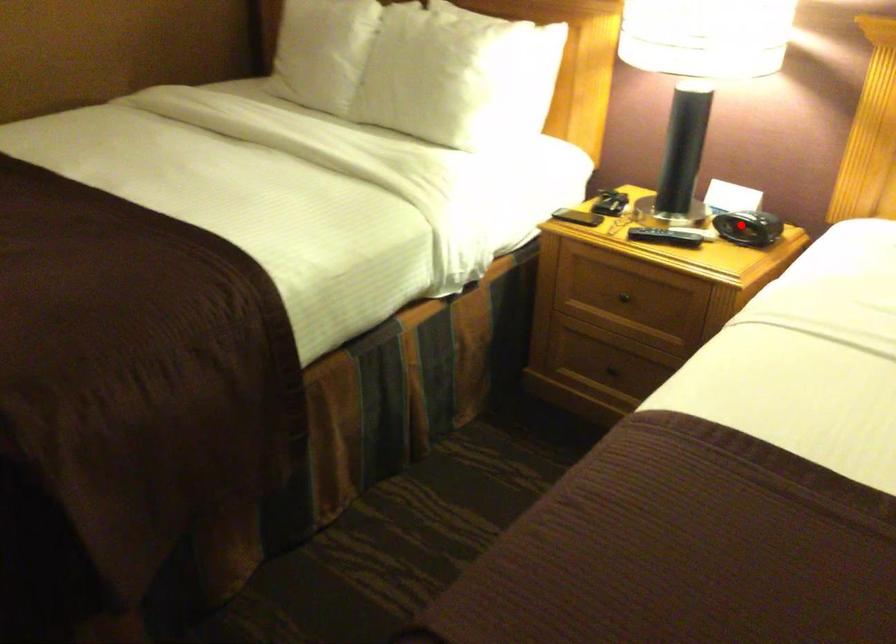
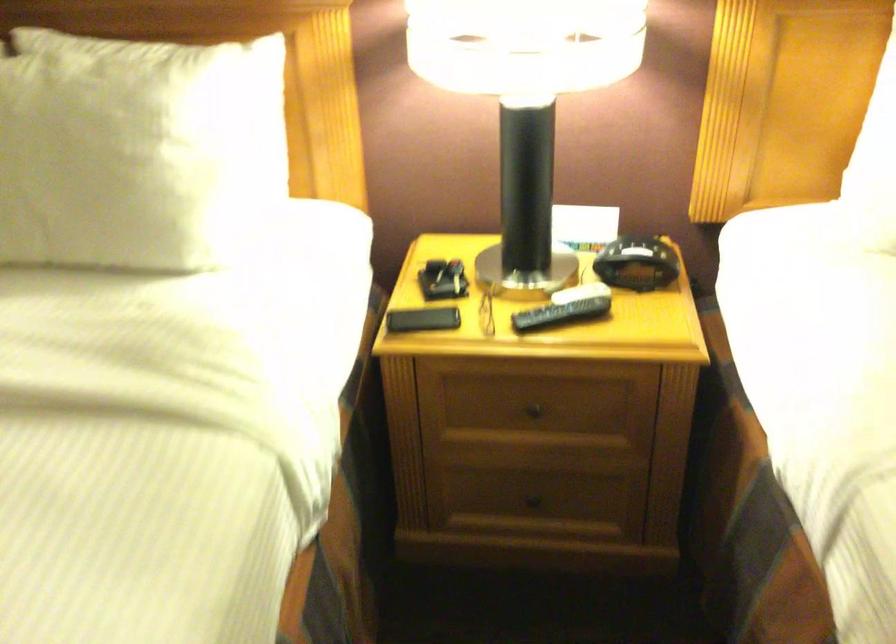
Question: I am providing you with two images of the same scene from different viewpoints. A red point is marked on the first image. Can you still see the location of the red point in image 2?

Choices:
 (A) Yes
 (B) No

Answer: (A)